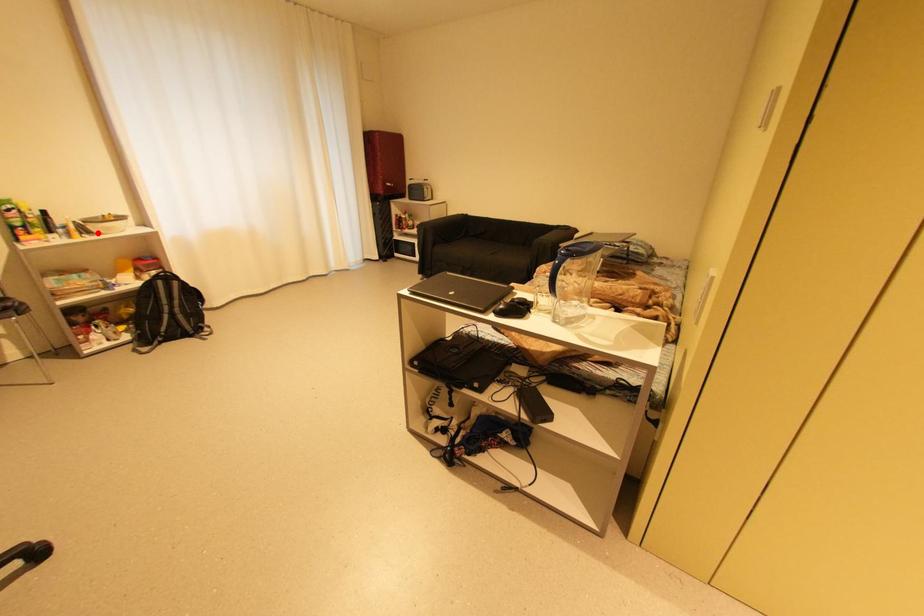
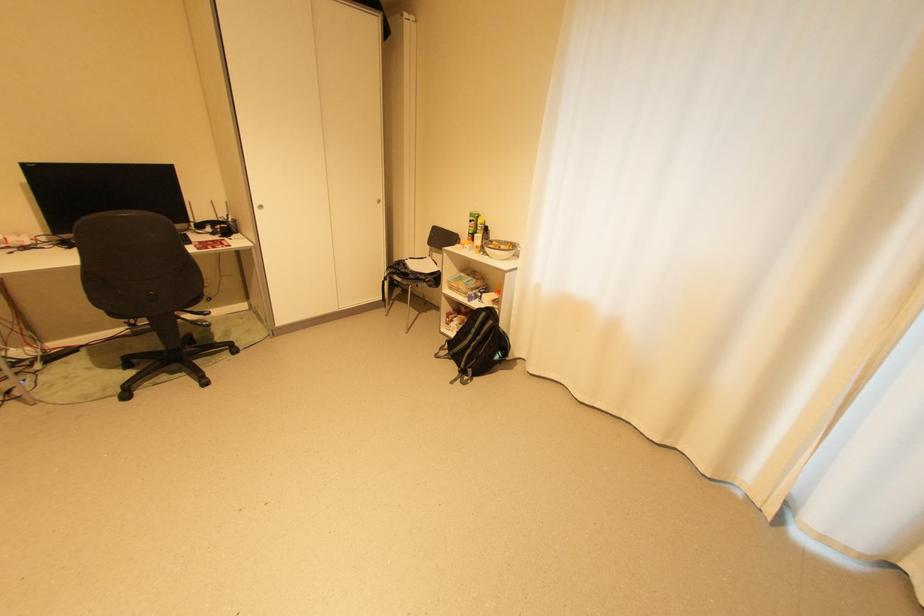
In the second image, find the point that corresponds to the highlighted location in the first image.

(492, 253)